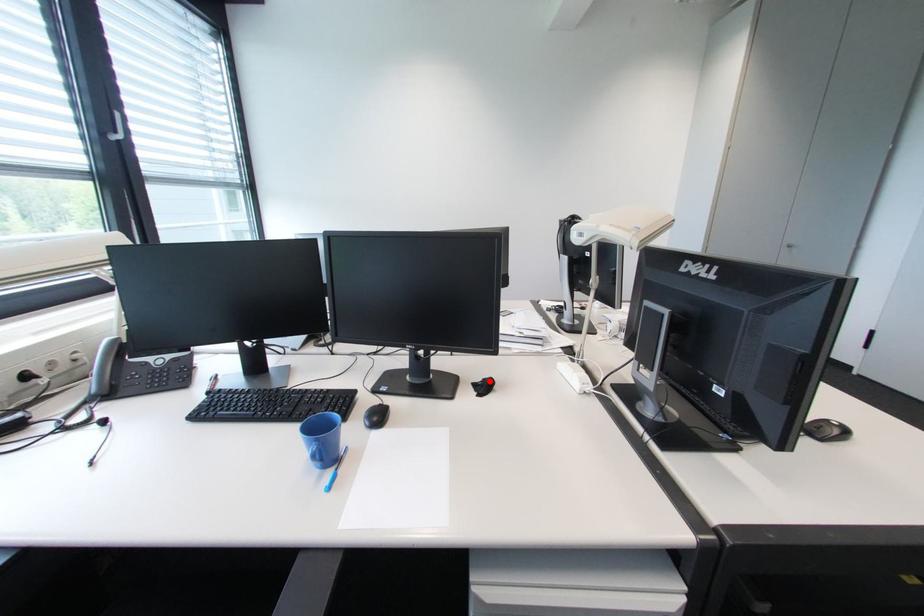
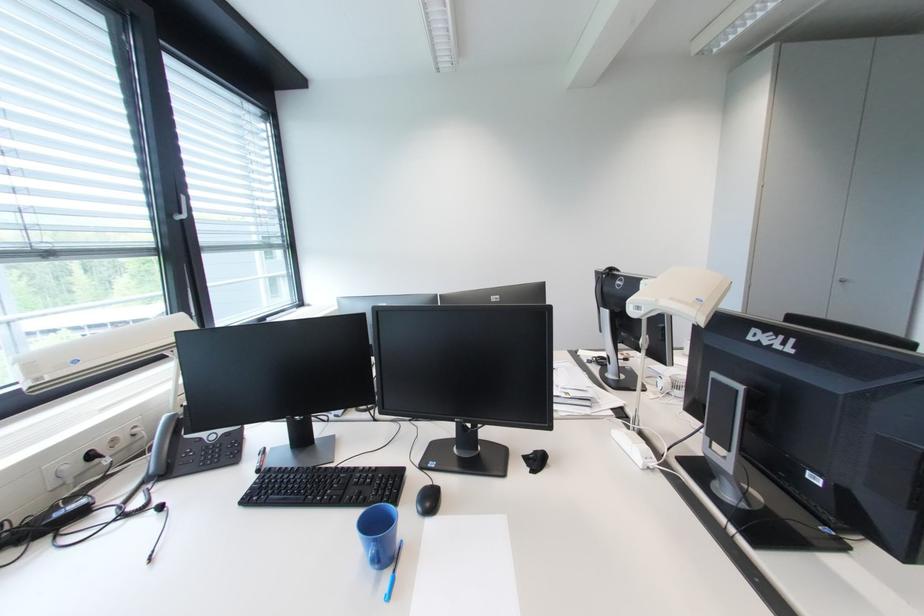
Where in the second image is the point corresponding to the highlighted location from the first image?

(541, 454)